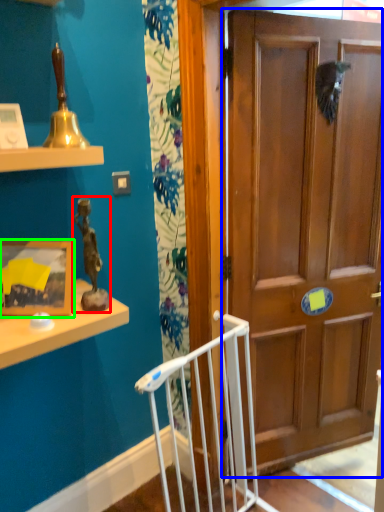
Question: Based on their relative distances, which object is nearer to toy (highlighted by a red box)? Choose from door (highlighted by a blue box) and picture frame (highlighted by a green box).

Choices:
 (A) door
 (B) picture frame

Answer: (B)